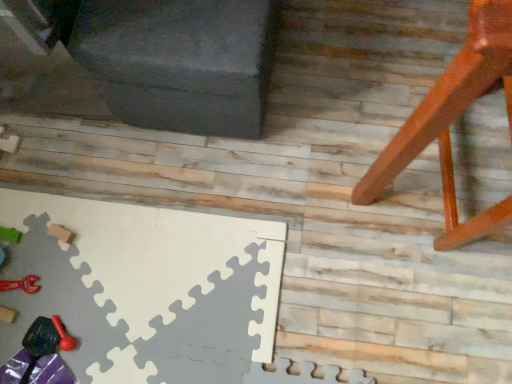
Locate an element on the screen. The width and height of the screenshot is (512, 384). matte orange wood chair at right is located at coordinates (453, 120).

This screenshot has height=384, width=512. Describe the element at coordinates (453, 120) in the screenshot. I see `matte orange wood chair at right` at that location.

The width and height of the screenshot is (512, 384). Identify the location of metallic red wrench at lower left. (21, 284).

Describe the element at coordinates (21, 284) in the screenshot. The width and height of the screenshot is (512, 384). I see `metallic red wrench at lower left` at that location.

This screenshot has width=512, height=384. Find the location of `matte orange wood chair at right`. matte orange wood chair at right is located at coordinates 453,120.

Visually, is matte orange wood chair at right positioned to the left or to the right of metallic red wrench at lower left?

matte orange wood chair at right is positioned on metallic red wrench at lower left's right side.

Considering the positions of objects matte orange wood chair at right and metallic red wrench at lower left in the image provided, who is in front, matte orange wood chair at right or metallic red wrench at lower left?

matte orange wood chair at right is in front.

Which point is more forward, [379,192] or [38,286]?

The point [379,192] is in front.

From the image's perspective, is matte orange wood chair at right above or below metallic red wrench at lower left?

Clearly, from the image's perspective, matte orange wood chair at right is above metallic red wrench at lower left.

From a real-world perspective, which object stands above the other?

matte orange wood chair at right.

Between matte orange wood chair at right and metallic red wrench at lower left, which one has smaller width?

metallic red wrench at lower left.

From the picture: Is matte orange wood chair at right taller or shorter than metallic red wrench at lower left?

Considering their sizes, matte orange wood chair at right has more height than metallic red wrench at lower left.

Considering the sizes of matte orange wood chair at right and metallic red wrench at lower left in the image, is matte orange wood chair at right bigger or smaller than metallic red wrench at lower left?

Considering their sizes, matte orange wood chair at right takes up more space than metallic red wrench at lower left.

Is matte orange wood chair at right situated inside metallic red wrench at lower left or outside?

matte orange wood chair at right cannot be found inside metallic red wrench at lower left.

Is matte orange wood chair at right with metallic red wrench at lower left?

No, matte orange wood chair at right is not making contact with metallic red wrench at lower left.

In the scene shown: Is matte orange wood chair at right facing towards metallic red wrench at lower left?

No, matte orange wood chair at right is not oriented towards metallic red wrench at lower left.

Consider the image. How many degrees apart are the facing directions of matte orange wood chair at right and metallic red wrench at lower left?

They differ by 99.8 degrees in their facing directions.

Where is `toy on the left of the matte orange wood chair at right`? toy on the left of the matte orange wood chair at right is located at coordinates (21, 284).

Does metallic red wrench at lower left appear on the left side of matte orange wood chair at right?

Yes.

Relative to matte orange wood chair at right, is metallic red wrench at lower left in front or behind?

Clearly, metallic red wrench at lower left is behind matte orange wood chair at right.

Which is more distant, (x=20, y=282) or (x=442, y=185)?

The point (x=442, y=185) is farther.

Based on the photo, from the image's perspective, is metallic red wrench at lower left beneath matte orange wood chair at right?

Yes.

From a real-world perspective, relative to matte orange wood chair at right, is metallic red wrench at lower left vertically above or below?

metallic red wrench at lower left is below matte orange wood chair at right.

Considering the sizes of metallic red wrench at lower left and matte orange wood chair at right in the image, is metallic red wrench at lower left wider or thinner than matte orange wood chair at right?

metallic red wrench at lower left is thinner than matte orange wood chair at right.

Which of these two, metallic red wrench at lower left or matte orange wood chair at right, stands taller?

matte orange wood chair at right.

Considering the relative sizes of metallic red wrench at lower left and matte orange wood chair at right in the image provided, is metallic red wrench at lower left bigger than matte orange wood chair at right?

No.

In the scene shown: Is matte orange wood chair at right located within metallic red wrench at lower left?

No, matte orange wood chair at right is located outside of metallic red wrench at lower left.

Consider the image. Is there a large distance between metallic red wrench at lower left and matte orange wood chair at right?

metallic red wrench at lower left is far away from matte orange wood chair at right.

Is metallic red wrench at lower left looking in the opposite direction of matte orange wood chair at right?

No, metallic red wrench at lower left's orientation is not away from matte orange wood chair at right.

In the scene shown: How different are the orientations of metallic red wrench at lower left and matte orange wood chair at right in degrees?

metallic red wrench at lower left and matte orange wood chair at right are facing 99.8 degrees away from each other.

How much distance is there between metallic red wrench at lower left and matte orange wood chair at right?

3.30 feet.

The width and height of the screenshot is (512, 384). I want to click on furniture in front of the metallic red wrench at lower left, so click(453, 120).

Find the location of `toy on the left of the matte orange wood chair at right`. toy on the left of the matte orange wood chair at right is located at coordinates (21, 284).

I want to click on furniture that appears above the metallic red wrench at lower left (from the image's perspective), so click(x=453, y=120).